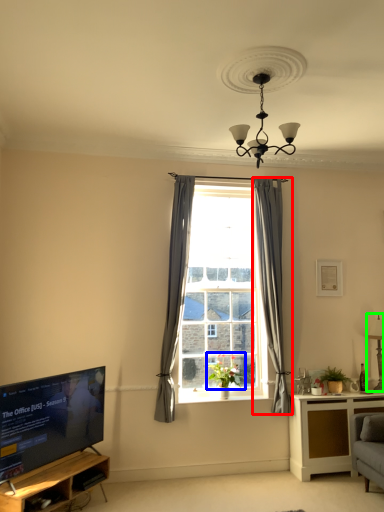
Question: Which is farther away from curtain (highlighted by a red box)? plant (highlighted by a blue box) or lamp (highlighted by a green box)?

Choices:
 (A) plant
 (B) lamp

Answer: (B)